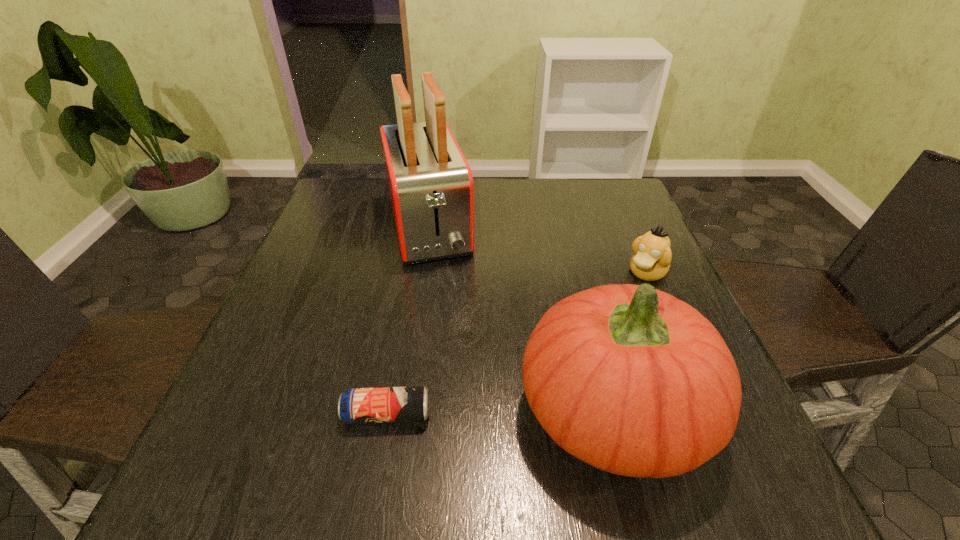
Identify the location of free space located on the front-facing side of the toaster. The image size is (960, 540). (444, 301).

Locate an element on the screen. vacant space situated on the front-facing side of the toaster is located at coordinates (445, 307).

Where is `object that is at the far edge`? object that is at the far edge is located at coordinates (430, 183).

Find the location of a particular element. The height and width of the screenshot is (540, 960). beer can at the near edge is located at coordinates (385, 404).

Find the location of a particular element. pumpkin that is at the near edge is located at coordinates (627, 378).

This screenshot has height=540, width=960. What are the coordinates of `pumpkin present at the right edge` in the screenshot? It's located at (627, 378).

Image resolution: width=960 pixels, height=540 pixels. I want to click on duckling present at the right edge, so click(652, 256).

Locate an element on the screen. Image resolution: width=960 pixels, height=540 pixels. object that is at the near right corner is located at coordinates (627, 378).

The image size is (960, 540). In order to click on blank space at the far edge of the desktop in this screenshot , I will do `click(384, 201)`.

I want to click on vacant space at the near edge of the desktop, so click(315, 435).